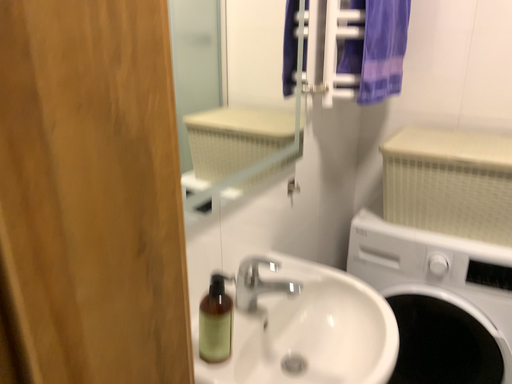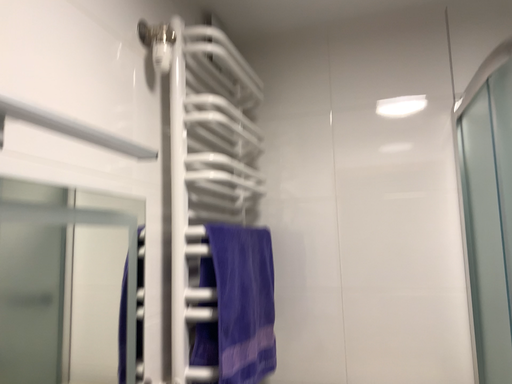
Question: How did the camera likely rotate when shooting the video?

Choices:
 (A) rotated downward
 (B) rotated upward

Answer: (B)